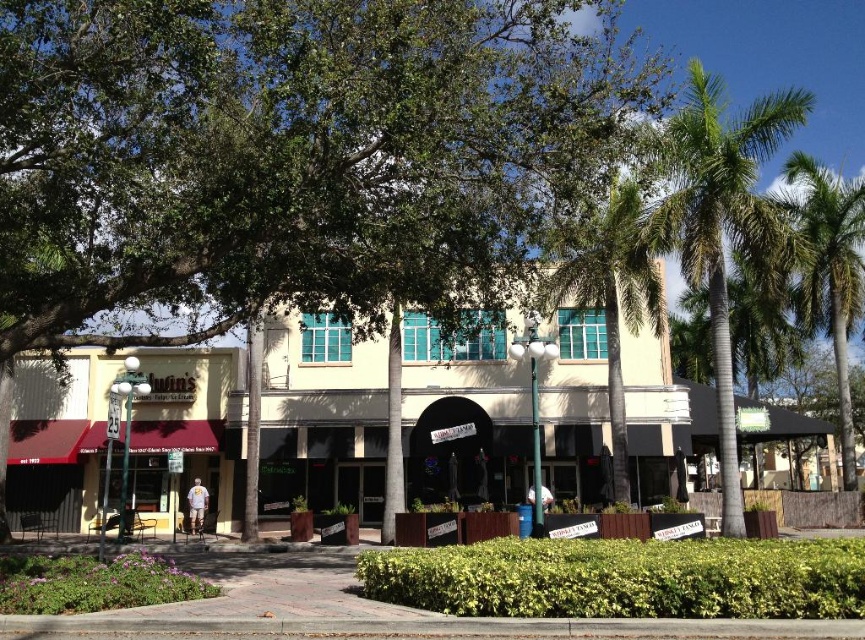
Question: Can you confirm if green leafy tree at center is positioned above green leafy palm tree at right?

Choices:
 (A) no
 (B) yes

Answer: (B)

Question: Among these points, which one is nearest to the camera?

Choices:
 (A) coord(564,278)
 (B) coord(127,84)
 (C) coord(719,83)

Answer: (B)

Question: Is green leafy tree at center above green leafy palm tree at center?

Choices:
 (A) no
 (B) yes

Answer: (B)

Question: Considering the real-world distances, which object is closest to the green leafy palm tree at upper right?

Choices:
 (A) green leafy tree at center
 (B) green leafy palm tree at right
 (C) beige concrete storefront at center

Answer: (B)

Question: Which object appears closest to the camera in this image?

Choices:
 (A) green leafy tree at center
 (B) green leafy palm tree at upper right
 (C) beige concrete storefront at center
 (D) green leafy palm tree at center

Answer: (A)

Question: Does beige concrete storefront at center appear on the right side of green leafy palm tree at right?

Choices:
 (A) yes
 (B) no

Answer: (B)